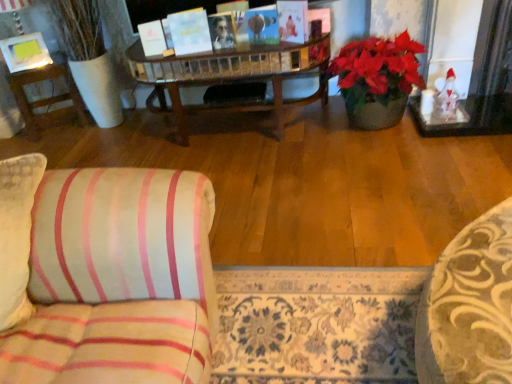
Question: Is matte yellow picture frame at upper left in front of or behind wooden side table at left in the image?

Choices:
 (A) behind
 (B) front

Answer: (B)

Question: In terms of width, does matte yellow picture frame at upper left look wider or thinner when compared to wooden side table at left?

Choices:
 (A) thin
 (B) wide

Answer: (A)

Question: Is matte yellow picture frame at upper left bigger or smaller than wooden side table at left?

Choices:
 (A) small
 (B) big

Answer: (A)

Question: Is wooden side table at left to the left or to the right of matte yellow picture frame at upper left in the image?

Choices:
 (A) left
 (B) right

Answer: (B)

Question: From the image's perspective, relative to matte yellow picture frame at upper left, is wooden side table at left above or below?

Choices:
 (A) below
 (B) above

Answer: (A)

Question: Do you think wooden side table at left is within matte yellow picture frame at upper left, or outside of it?

Choices:
 (A) outside
 (B) inside

Answer: (A)

Question: From a real-world perspective, is wooden side table at left above or below matte yellow picture frame at upper left?

Choices:
 (A) above
 (B) below

Answer: (B)